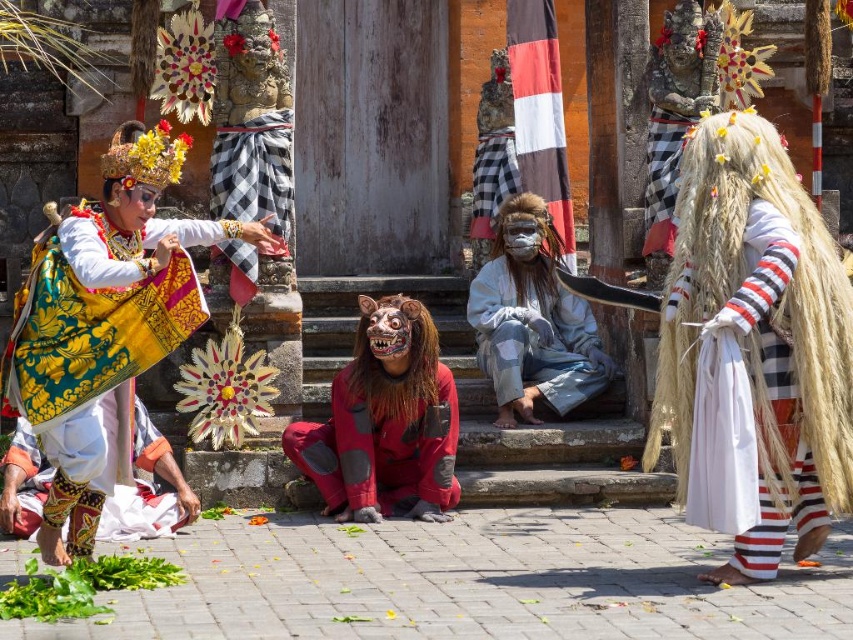
You are a photographer standing at the center of the scene. You want to capture a closeup shot of the white woven fabric at right. Based on its position, which direction should you move to get closer to it?

The white woven fabric at right is located at point 0.620 on the x axis and 0.914 on the y axis. Since you are at the center, moving towards the right and upward direction would bring you closer to the white woven fabric at right.

You are a photographer standing at the center of the scene. You want to take a photo focusing on both the dancer in yellow and green attire and the wooden door with banners. Which of the two points, point 1 at coordinates (521, 323) or point 2 at (12, 477), should you focus on to ensure both subjects are in sharp focus?

You should focus on point 1 at coordinates (521, 323) because it is further to the camera than point 2 at (12, 477). This ensures the dancer in yellow and green attire and the wooden door with banners are within the depth of field for sharp focus.